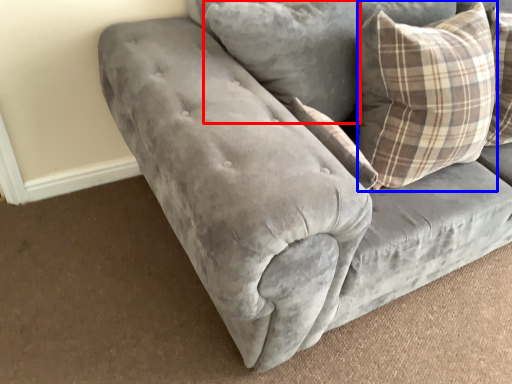
Question: Which object appears farthest to the camera in this image, pillow (highlighted by a red box) or pillow (highlighted by a blue box)?

Choices:
 (A) pillow
 (B) pillow

Answer: (A)